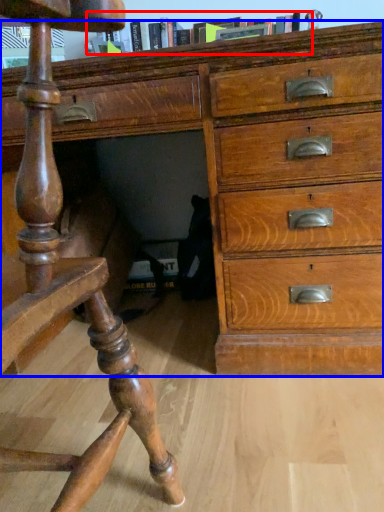
Question: Which point is further to the camera, book (highlighted by a red box) or chest of drawers (highlighted by a blue box)?

Choices:
 (A) book
 (B) chest of drawers

Answer: (A)